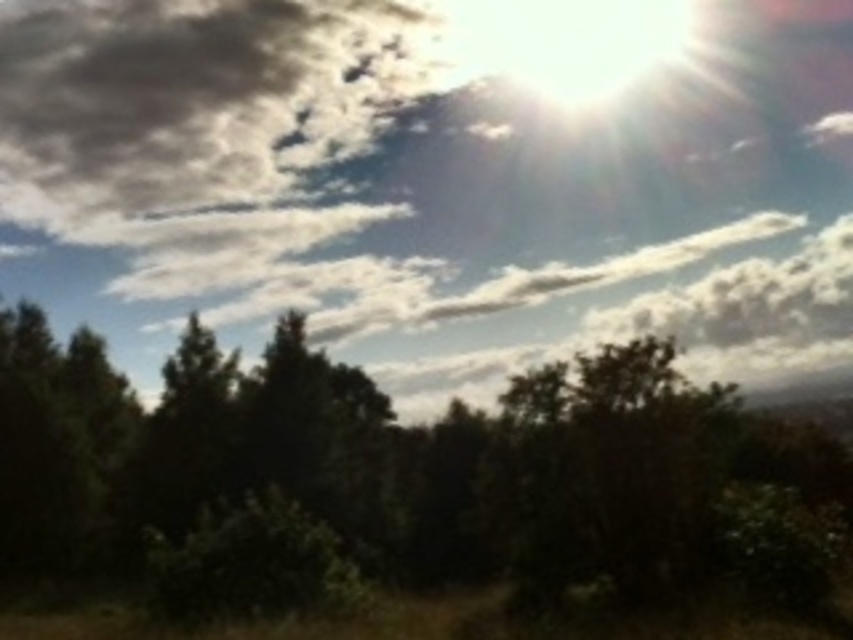
You are an observer looking at the scene. Which object is positioned to the right side of the other between the green leafy tree at center and the dark gray fluffy cloud at upper left?

The green leafy tree at center is positioned to the right of the dark gray fluffy cloud at upper left.

You are an artist trying to paint the scene. You want to ensure the white fluffy cloud at upper center and the green leafy tree at center are proportionally accurate. Which one should you paint wider?

The white fluffy cloud at upper center should be painted wider because its width is larger than the green leafy tree at center.